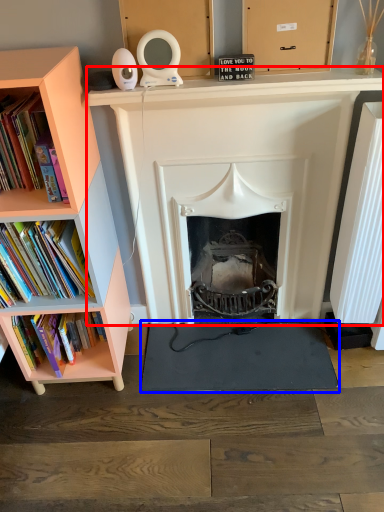
Question: Which of the following is the closest to the observer, fireplace (highlighted by a red box) or yoga mat (highlighted by a blue box)?

Choices:
 (A) fireplace
 (B) yoga mat

Answer: (A)